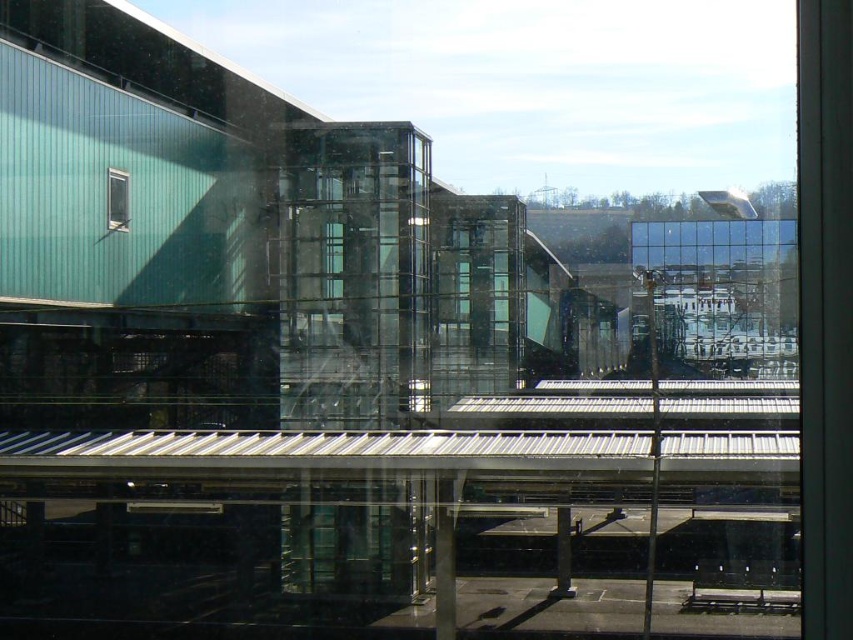
In the scene shown: Is transparent glass window at center to the right of clear glass window at upper left from the viewer's perspective?

Yes, transparent glass window at center is to the right of clear glass window at upper left.

Where is `transparent glass window at center`? The image size is (853, 640). transparent glass window at center is located at coordinates (332, 259).